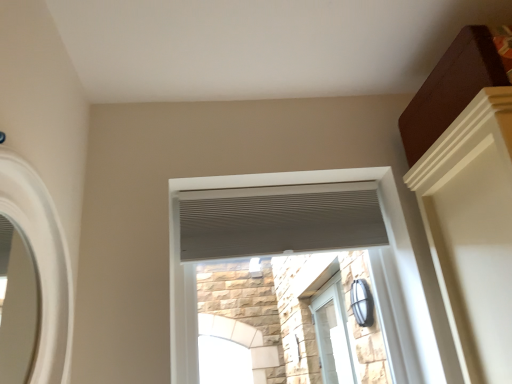
Question: Is the position of white textured blind at upper center less distant than that of white textured vent at center, which appears as the second window when viewed from the back?

Choices:
 (A) no
 (B) yes

Answer: (A)

Question: From a real-world perspective, is white textured blind at upper center located higher than white textured vent at center, which appears as the second window when viewed from the back?

Choices:
 (A) yes
 (B) no

Answer: (A)

Question: Can you confirm if white textured blind at upper center is wider than white textured vent at center, which appears as the second window when viewed from the back?

Choices:
 (A) no
 (B) yes

Answer: (A)

Question: Is white textured blind at upper center outside of white textured vent at center, acting as the 2th window starting from the right?

Choices:
 (A) no
 (B) yes

Answer: (B)

Question: Does white textured blind at upper center have a larger size compared to white textured vent at center, arranged as the 2th window when viewed from the front?

Choices:
 (A) no
 (B) yes

Answer: (A)

Question: Choose the correct answer: Is clear glass door at center, which appears as the 1th window when ordered from the bottom, inside white textured vent at center, arranged as the 2th window when viewed from the left, or outside it?

Choices:
 (A) inside
 (B) outside

Answer: (B)

Question: Is clear glass door at center, which is counted as the first window, starting from the back, taller or shorter than white textured vent at center, which appears as the second window when viewed from the back?

Choices:
 (A) short
 (B) tall

Answer: (B)

Question: Is clear glass door at center, marked as the 3th window in a left-to-right arrangement, in front of or behind white textured vent at center, acting as the 2th window starting from the right, in the image?

Choices:
 (A) front
 (B) behind

Answer: (B)

Question: From a real-world perspective, relative to white textured vent at center, marked as the 2th window in a top-to-bottom arrangement, is clear glass door at center, which is counted as the first window, starting from the back, vertically above or below?

Choices:
 (A) above
 (B) below

Answer: (B)

Question: In terms of height, does clear glass door at center, which is the third window in top-to-bottom order, look taller or shorter compared to white textured blind at upper center?

Choices:
 (A) tall
 (B) short

Answer: (A)

Question: From the image's perspective, is clear glass door at center, which is counted as the first window, starting from the back, above or below white textured blind at upper center?

Choices:
 (A) below
 (B) above

Answer: (A)

Question: From a real-world perspective, is clear glass door at center, marked as the 3th window in a left-to-right arrangement, physically located above or below white textured blind at upper center?

Choices:
 (A) below
 (B) above

Answer: (A)

Question: In terms of size, does clear glass door at center, which appears as the 1th window when ordered from the bottom, appear bigger or smaller than white textured blind at upper center?

Choices:
 (A) small
 (B) big

Answer: (B)

Question: From a real-world perspective, is white textured blind at upper center above or below white textured vent at center, arranged as the 2th window when viewed from the left?

Choices:
 (A) above
 (B) below

Answer: (A)

Question: Considering the positions of white textured blind at upper center and white textured vent at center, arranged as the 2th window when viewed from the left, in the image, is white textured blind at upper center taller or shorter than white textured vent at center, arranged as the 2th window when viewed from the left,?

Choices:
 (A) short
 (B) tall

Answer: (A)